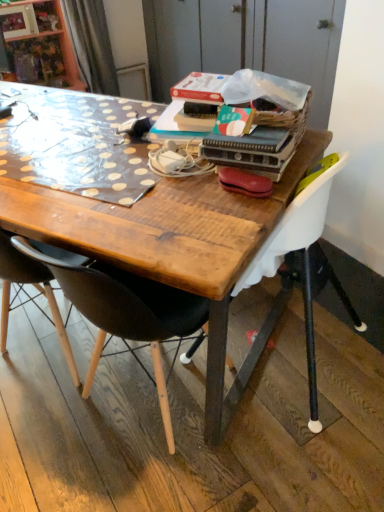
Question: From a real-world perspective, is leather-like brown handbag at center beneath black plastic chair at center, which appears as the 2th chair when viewed from the right?

Choices:
 (A) no
 (B) yes

Answer: (A)

Question: From the image's perspective, does leather-like brown handbag at center appear lower than black plastic chair at center, which is the first chair from left to right?

Choices:
 (A) yes
 (B) no

Answer: (B)

Question: Is black plastic chair at center, which is the first chair from left to right, inside leather-like brown handbag at center?

Choices:
 (A) yes
 (B) no

Answer: (B)

Question: Is leather-like brown handbag at center positioned far away from black plastic chair at center, which is the first chair from left to right?

Choices:
 (A) yes
 (B) no

Answer: (B)

Question: Can you confirm if leather-like brown handbag at center is shorter than black plastic chair at center, which appears as the 2th chair when viewed from the right?

Choices:
 (A) yes
 (B) no

Answer: (A)

Question: Would you say black plastic chair at center, which appears as the 2th chair when viewed from the right, is inside or outside wooden desk at center?

Choices:
 (A) outside
 (B) inside

Answer: (B)

Question: In terms of height, does black plastic chair at center, which is the first chair from left to right, look taller or shorter compared to wooden desk at center?

Choices:
 (A) short
 (B) tall

Answer: (B)

Question: Is point (112, 291) closer or farther from the camera than point (132, 197)?

Choices:
 (A) closer
 (B) farther

Answer: (A)

Question: Would you say black plastic chair at center, which appears as the 2th chair when viewed from the right, is to the left or to the right of wooden desk at center in the picture?

Choices:
 (A) left
 (B) right

Answer: (B)

Question: From the image's perspective, is white plastic chair at upper right, which is the 1th chair from right to left, above or below black plastic chair at center, which is the first chair from left to right?

Choices:
 (A) above
 (B) below

Answer: (A)

Question: Is point (345, 159) positioned closer to the camera than point (127, 328)?

Choices:
 (A) closer
 (B) farther

Answer: (B)

Question: Considering the positions of white plastic chair at upper right, which is the 1th chair from right to left, and black plastic chair at center, which is the first chair from left to right, in the image, is white plastic chair at upper right, which is the 1th chair from right to left, bigger or smaller than black plastic chair at center, which is the first chair from left to right,?

Choices:
 (A) small
 (B) big

Answer: (B)

Question: Which is correct: white plastic chair at upper right, which is the 1th chair from right to left, is inside black plastic chair at center, which is the first chair from left to right, or outside of it?

Choices:
 (A) outside
 (B) inside

Answer: (A)

Question: In the image, is black plastic chair at center, which appears as the 2th chair when viewed from the right, positioned in front of or behind white plastic chair at upper right, which is the 1th chair from right to left?

Choices:
 (A) front
 (B) behind

Answer: (A)

Question: From the image's perspective, is black plastic chair at center, which is the first chair from left to right, above or below white plastic chair at upper right, which is the 1th chair from right to left?

Choices:
 (A) below
 (B) above

Answer: (A)